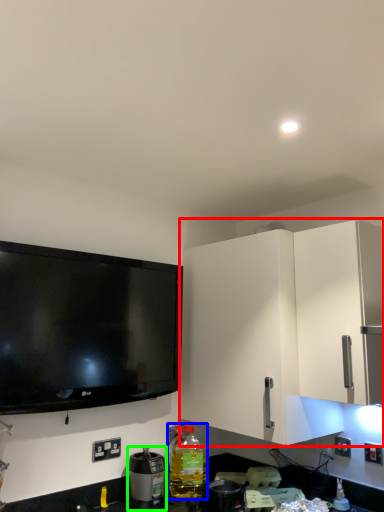
Question: Considering the real-world distances, which object is farthest from cabinetry (highlighted by a red box)? bottle (highlighted by a blue box) or appliance (highlighted by a green box)?

Choices:
 (A) bottle
 (B) appliance

Answer: (B)